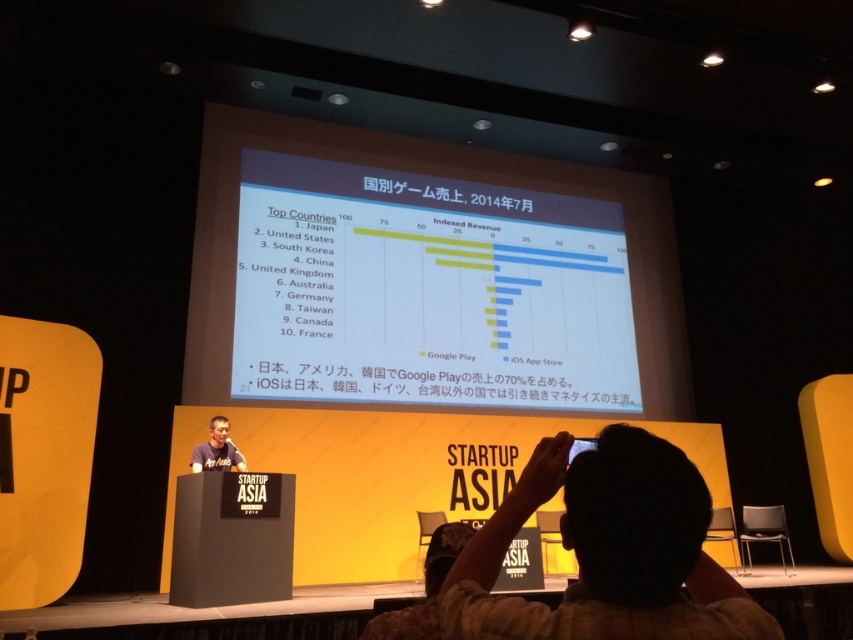
Question: Can you confirm if matte white chart at center is positioned to the left of matte black shirt at center?

Choices:
 (A) yes
 (B) no

Answer: (B)

Question: Is matte white chart at center closer to camera compared to brown plaid shirt at lower right?

Choices:
 (A) no
 (B) yes

Answer: (A)

Question: Based on their relative distances, which object is farther from the matte white chart at center?

Choices:
 (A) brown plaid shirt at lower right
 (B) matte black shirt at center

Answer: (A)

Question: Which point appears closest to the camera in this image?

Choices:
 (A) (444, 611)
 (B) (213, 445)
 (C) (270, 291)

Answer: (A)

Question: Is brown plaid shirt at lower right thinner than matte black shirt at center?

Choices:
 (A) yes
 (B) no

Answer: (B)

Question: Which point appears closest to the camera in this image?

Choices:
 (A) (572, 492)
 (B) (405, 262)

Answer: (A)